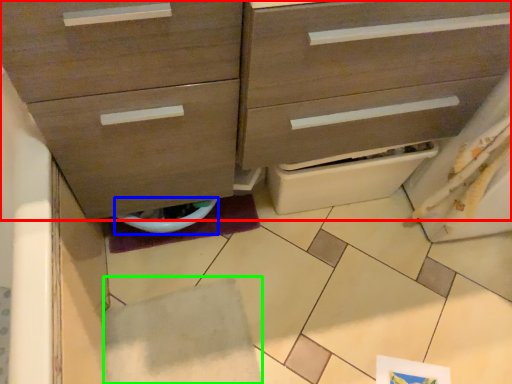
Question: Which object is positioned farthest from chest of drawers (highlighted by a red box)? Select from toilet bowl (highlighted by a blue box) and tile (highlighted by a green box).

Choices:
 (A) toilet bowl
 (B) tile

Answer: (B)